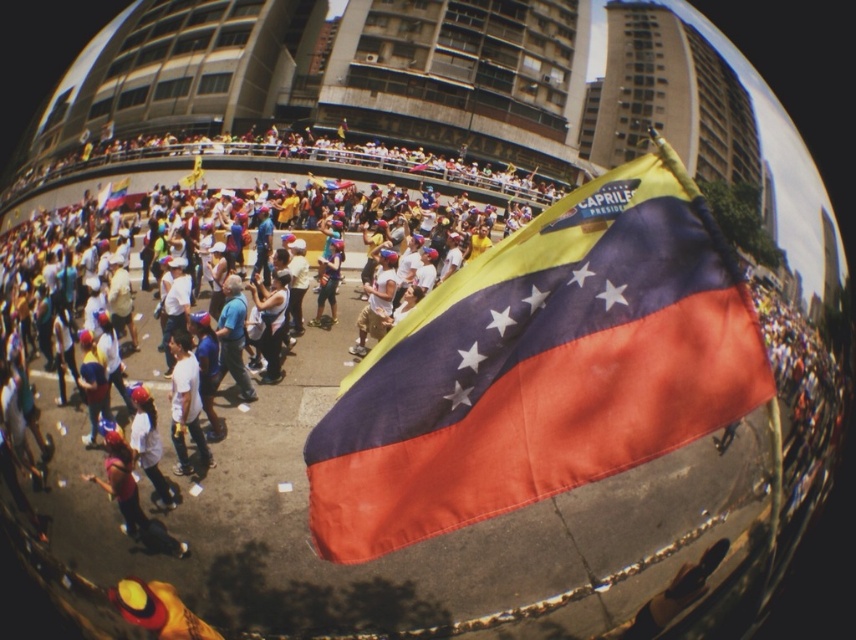
You are a photographer standing at the center of the scene. You want to take a photo of the point at coordinates point (601,211) and point (358,348). Which point should you focus on first to ensure both are in focus?

Point (601,211) is in front of point (358,348). Therefore, you should focus on the closer point (601,211) first to ensure both points are in focus.

You are a photographer standing in the crowd and want to take a photo of both point (550,212) and point (183,474). Which point is closer to your camera?

Point (550,212) is closer to the camera than point (183,474).

You are a photographer standing at the scene. You want to capture a closeup shot of the polyester flag at center. Given that your camera has a minimum focusing distance of 5 feet, will you be able to take the photo without moving closer?

The polyester flag at center is 5.12 feet away from the camera. Since the minimum focusing distance is 5 feet, the photographer can take the closeup shot without moving closer as the distance is slightly beyond the required minimum.